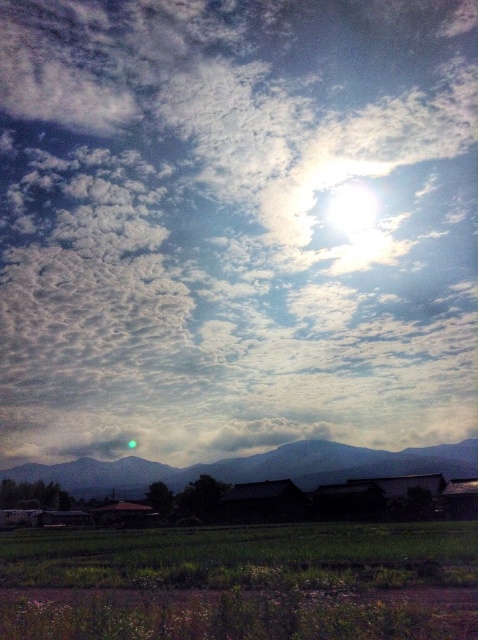
You are an artist planning to paint this rural landscape. You want to emphasize the contrast between the white fluffy cloud at upper center and the dark gray mountain at center. Which object should you make larger in your painting to highlight this contrast?

To emphasize the contrast between the white fluffy cloud at upper center and the dark gray mountain at center, you should make the white fluffy cloud at upper center larger since its width is already larger than the dark gray mountain at center, enhancing the visual distinction between the two.

You are a drone operator tasked with capturing aerial footage of the green grassy rice field at lower center and the dark gray mountain at center. According to the scene description, which object should you focus on first if you want to film from the lowest altitude possible?

The green grassy rice field at lower center should be filmed first because it is located above the dark gray mountain at center, meaning it is closer to the drone at a lower altitude.

Consider the image. You are a farmer standing at the edge of the field. You want to plant a new crop in the green grassy rice field at lower center. Based on its current location, what is the 2D coordinate of the field where you should start planting?

The 2D coordinate of the green grassy rice field at lower center is at point (241, 582), so you should start planting there.